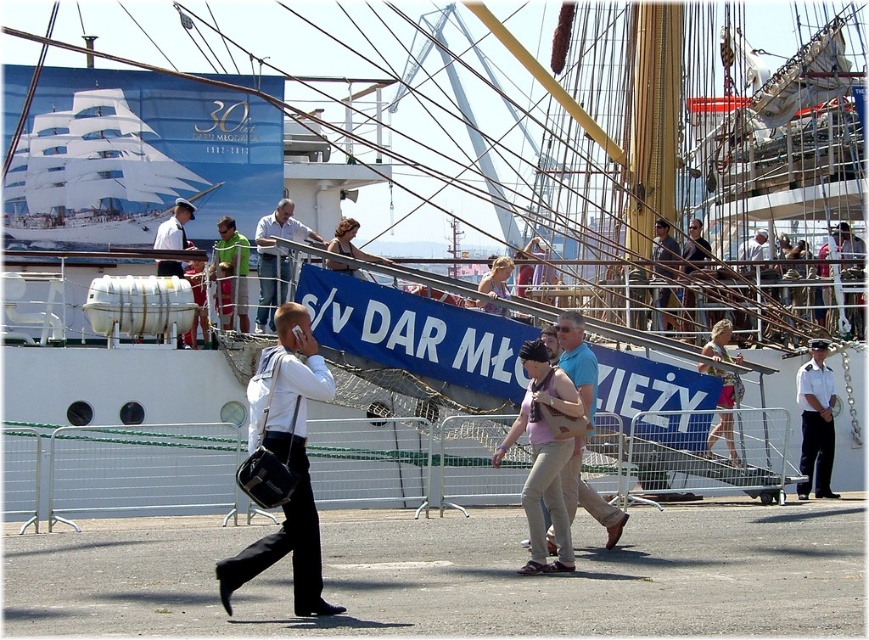
Question: Which object is positioned farthest from the white leather bag at center?

Choices:
 (A) white uniform at center
 (B) matte beige blouse at center

Answer: (A)

Question: Is light blue shirt at center to the left of white matte helmet at center from the viewer's perspective?

Choices:
 (A) no
 (B) yes

Answer: (A)

Question: Which point appears closest to the camera in this image?

Choices:
 (A) (478, 291)
 (B) (259, 243)

Answer: (A)

Question: Which object is closer to the camera taking this photo?

Choices:
 (A) matte black hair at center
 (B) matte beige blouse at center
 (C) white uniform at center

Answer: (A)

Question: Can you confirm if white glossy sailboat at upper left is positioned above light brown leather jacket at upper center?

Choices:
 (A) yes
 (B) no

Answer: (A)

Question: Can you confirm if green fabric shirt at center is positioned to the left of white matte helmet at center?

Choices:
 (A) yes
 (B) no

Answer: (B)